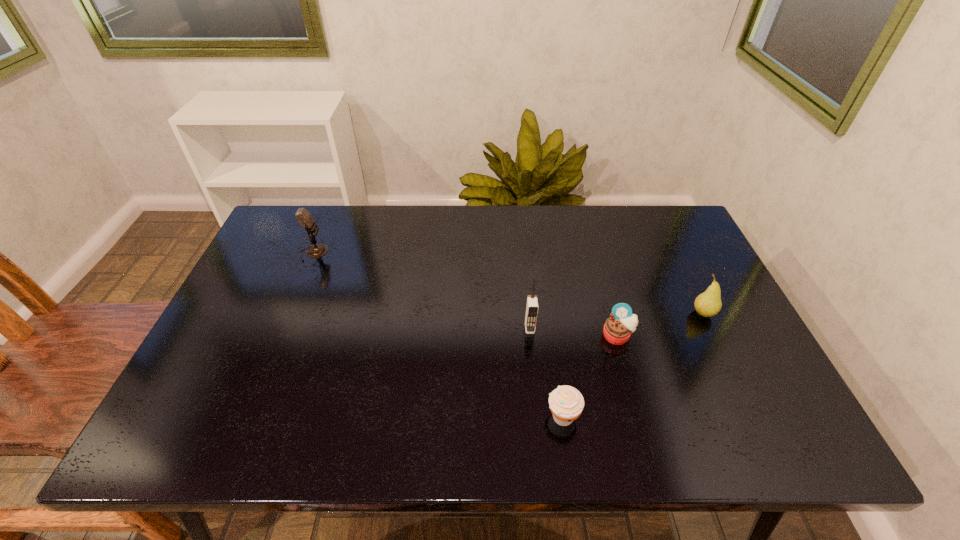
Image resolution: width=960 pixels, height=540 pixels. In order to click on vacant area at the near edge of the desktop in this screenshot , I will do `click(676, 431)`.

At what (x,y) coordinates should I click in order to perform the action: click on vacant region at the left edge of the desktop. Please return your answer as a coordinate pair (x, y). This screenshot has width=960, height=540. Looking at the image, I should click on (215, 372).

You are a GUI agent. You are given a task and a screenshot of the screen. Output one action in this format:
    pyautogui.click(x=<x>, y=<y>)
    Task: Click on the vacant space at the right edge of the desktop
    
    Given the screenshot: What is the action you would take?
    pyautogui.click(x=704, y=268)

Where is `vacant space at the far left corner of the desktop`? vacant space at the far left corner of the desktop is located at coordinates (281, 230).

Locate an element on the screen. The width and height of the screenshot is (960, 540). vacant space at the near left corner of the desktop is located at coordinates (237, 428).

At what (x,y) coordinates should I click in order to perform the action: click on free spot at the far right corner of the desktop. Please return your answer as a coordinate pair (x, y). Looking at the image, I should click on (675, 215).

The image size is (960, 540). Find the location of `free point between the farther muffin and the farthest object`. free point between the farther muffin and the farthest object is located at coordinates (466, 294).

At what (x,y) coordinates should I click in order to perform the action: click on vacant space that's between the rightmost object and the fourth object from left to right. Please return your answer as a coordinate pair (x, y). Image resolution: width=960 pixels, height=540 pixels. Looking at the image, I should click on (660, 325).

The image size is (960, 540). Find the location of `free space between the farther muffin and the pear`. free space between the farther muffin and the pear is located at coordinates coord(660,325).

Locate an element on the screen. This screenshot has width=960, height=540. vacant space that's between the fourth object from left to right and the microphone is located at coordinates (466, 294).